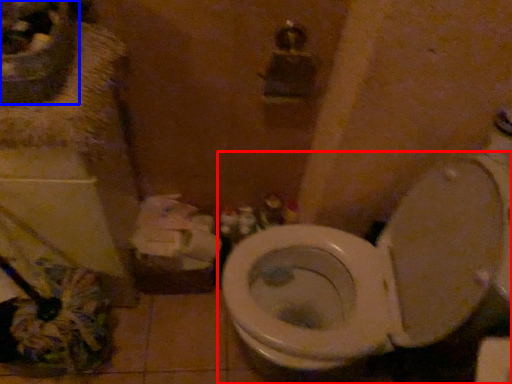
Question: Which point is further to the camera, toilet (highlighted by a red box) or sink (highlighted by a blue box)?

Choices:
 (A) toilet
 (B) sink

Answer: (B)